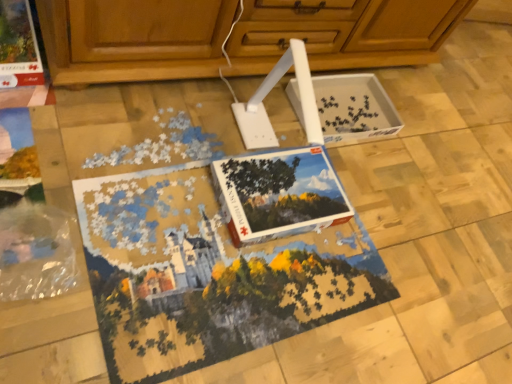
At what (x,y) coordinates should I click in order to perform the action: click on free space in front of wooden cabinet at upper center. Please return your answer as a coordinate pair (x, y). This screenshot has height=384, width=512. Looking at the image, I should click on (184, 215).